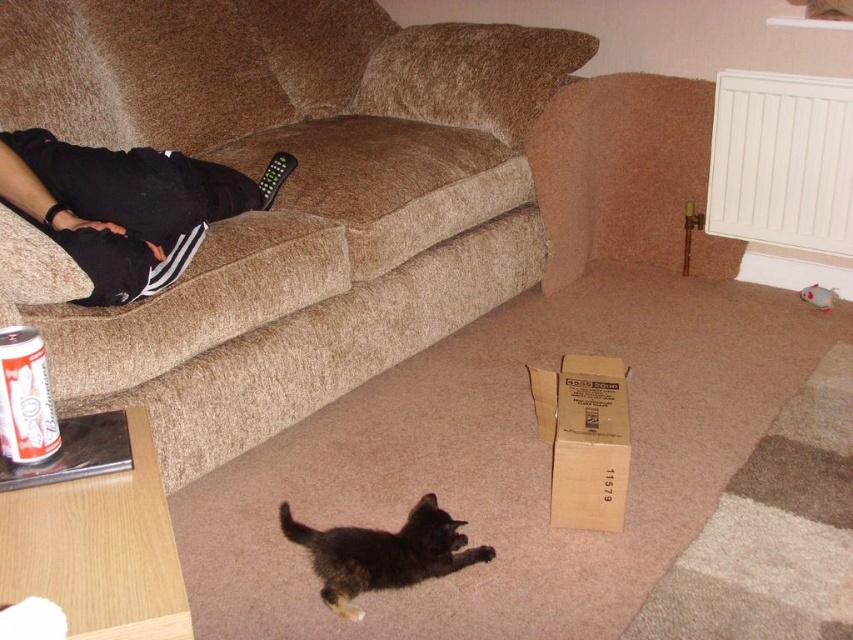
You are a delivery robot that needs to place a package on the table. The package is 14 inches long. Can you fit it between the black cotton shirt at upper left and the black plastic remote at center?

The black cotton shirt at upper left and black plastic remote at center are 14.21 inches apart from each other. Since the package is 14 inches long, it can fit between them as there is enough space.

You are standing in the living room and want to place a small toy between the two points marked as point [242,211] and point [32,413]. Which point should you place the toy closer to so that it appears closer to you?

The toy should be placed closer to point [242,211] because it is further to the viewer than point [32,413], making it appear closer.

Consider the image. You are standing in the living room and want to place a small toy between the two points marked as point (173, 177) and point (553, 508). Which point is closer to you so you can start placing the toy from there?

Point (173, 177) is closer to you than point (553, 508), so you should start placing the toy from point (173, 177).